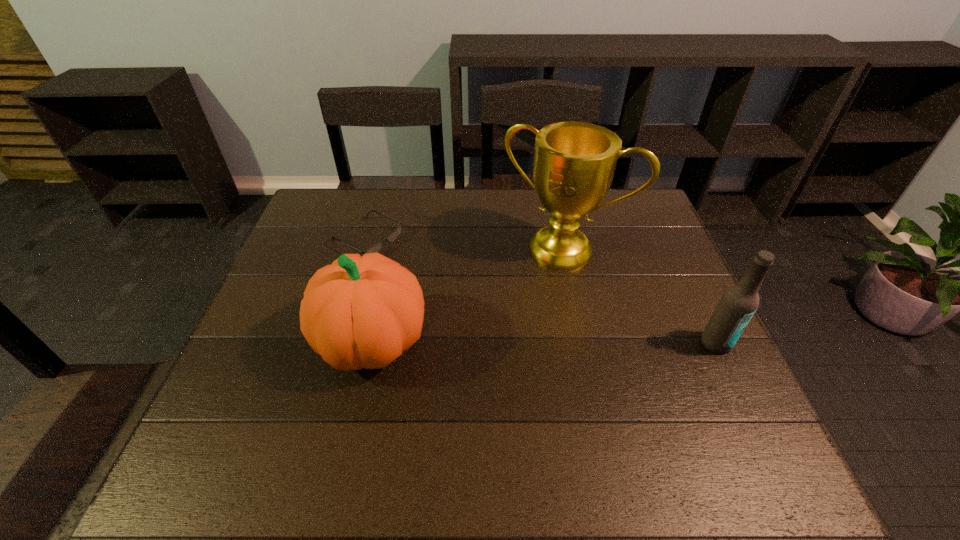
At what (x,y) coordinates should I click in order to perform the action: click on pumpkin. Please return your answer as a coordinate pair (x, y). This screenshot has width=960, height=540. Looking at the image, I should click on (359, 312).

Where is `beer bottle`? This screenshot has width=960, height=540. beer bottle is located at coordinates (739, 302).

Identify the location of the tallest object. (574, 163).

The image size is (960, 540). Identify the location of award. (574, 163).

I want to click on spectacles, so click(376, 248).

Identify the location of free spot located 0.150m on the right of the pumpkin. The height and width of the screenshot is (540, 960). (492, 341).

Image resolution: width=960 pixels, height=540 pixels. Find the location of `vacant space situated on the side of the rightmost object with the label`. vacant space situated on the side of the rightmost object with the label is located at coordinates (752, 418).

The height and width of the screenshot is (540, 960). In order to click on vacant space located 0.210m on the shiny surface of the award in this screenshot , I will do `click(514, 323)`.

Locate an element on the screen. Image resolution: width=960 pixels, height=540 pixels. vacant space located on the shiny surface of the award is located at coordinates (490, 370).

Identify the location of vacant space located on the shiny surface of the award. This screenshot has height=540, width=960. (526, 299).